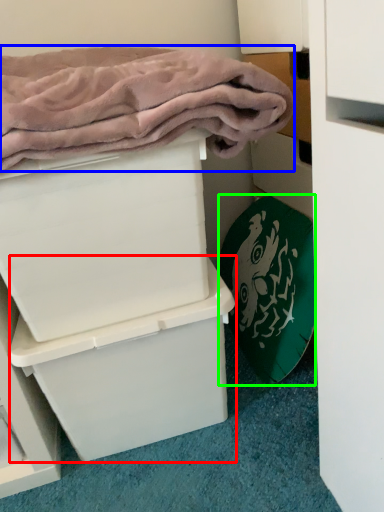
Question: Considering the real-world distances, which object is farthest from box (highlighted by a red box)? bath towel (highlighted by a blue box) or bath towel (highlighted by a green box)?

Choices:
 (A) bath towel
 (B) bath towel

Answer: (A)